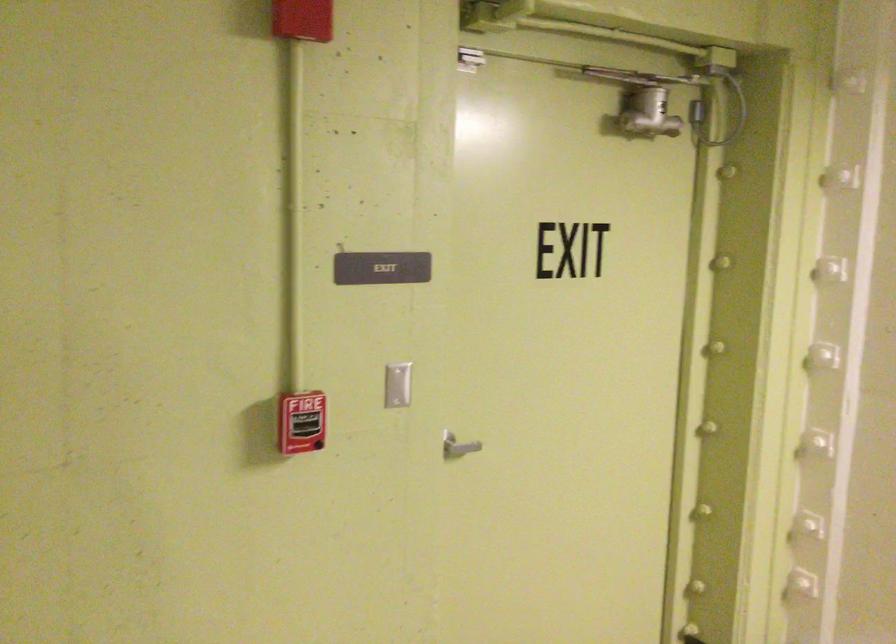
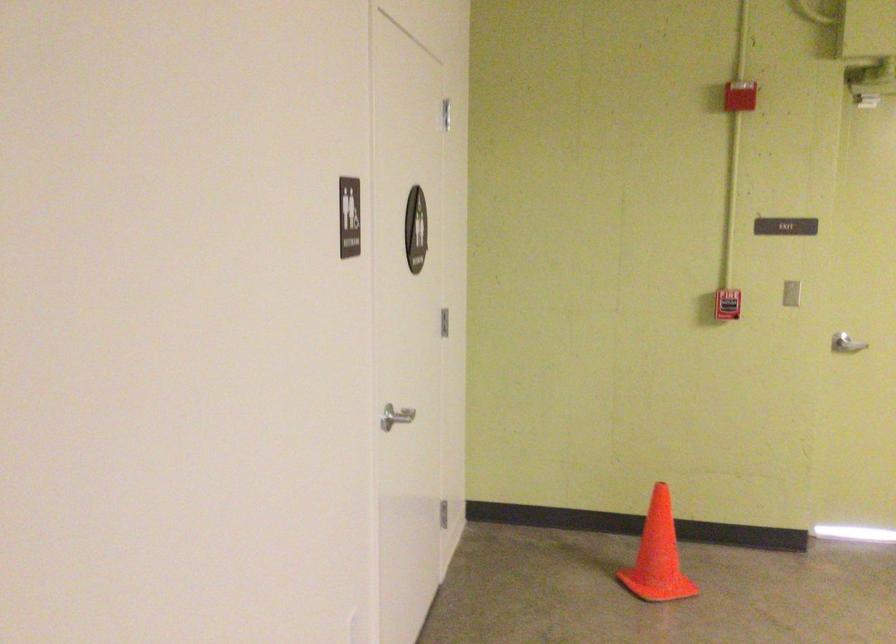
The point at (424, 460) is marked in the first image. Where is the corresponding point in the second image?

(846, 344)